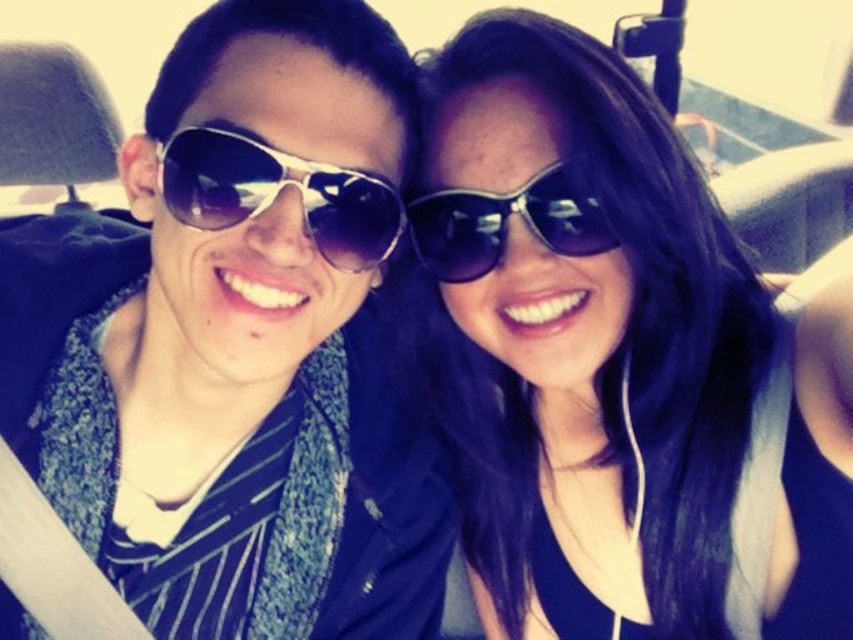
Can you confirm if metallic aviator sunglasses at left is taller than metallic reflective sunglasses at center?

Correct, metallic aviator sunglasses at left is much taller as metallic reflective sunglasses at center.

Which is more to the right, metallic aviator sunglasses at left or metallic reflective sunglasses at center?

Positioned to the right is metallic reflective sunglasses at center.

Who is more forward, [107,572] or [383,212]?

Point [383,212] is more forward.

The image size is (853, 640). Identify the location of metallic aviator sunglasses at left. (236, 342).

Does matte black sunglasses at upper center have a lesser width compared to metallic reflective sunglasses at center?

In fact, matte black sunglasses at upper center might be wider than metallic reflective sunglasses at center.

The height and width of the screenshot is (640, 853). What are the coordinates of `matte black sunglasses at upper center` in the screenshot? It's located at (618, 362).

At what (x,y) coordinates should I click in order to perform the action: click on matte black sunglasses at upper center. Please return your answer as a coordinate pair (x, y). The width and height of the screenshot is (853, 640). Looking at the image, I should click on (618, 362).

Is metallic reflective sunglasses at center to the right of shiny black sunglasses at center from the viewer's perspective?

No, metallic reflective sunglasses at center is not to the right of shiny black sunglasses at center.

Who is lower down, metallic reflective sunglasses at center or shiny black sunglasses at center?

shiny black sunglasses at center is lower down.

This screenshot has width=853, height=640. What are the coordinates of `metallic reflective sunglasses at center` in the screenshot? It's located at (277, 193).